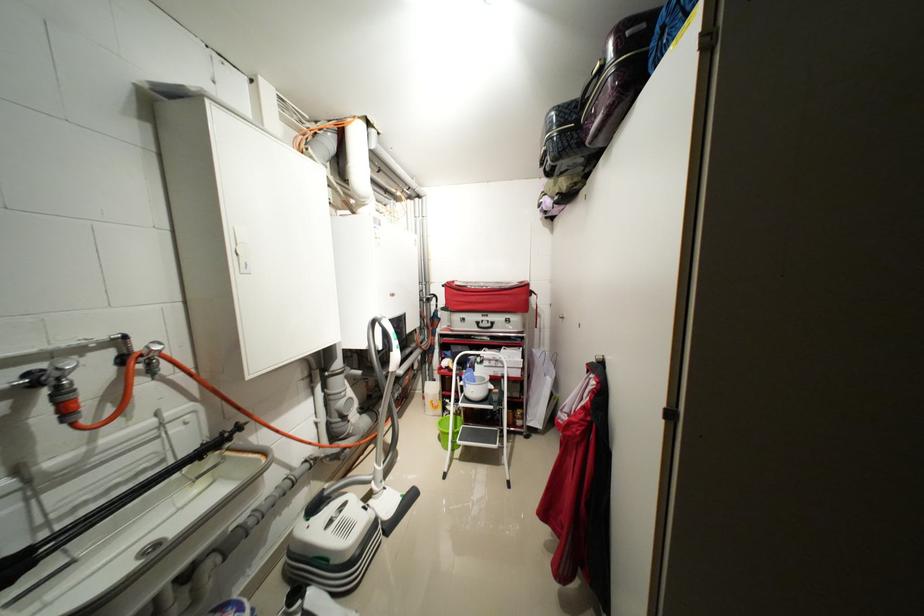
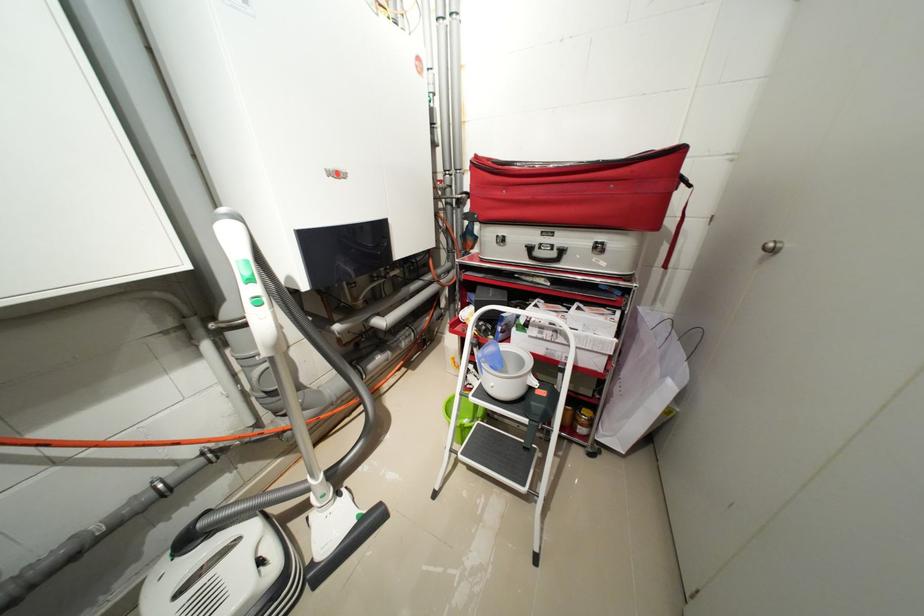
Question: What movement of the cameraman would produce the second image?

Choices:
 (A) Left
 (B) Right
 (C) Forward
 (D) Backward

Answer: (C)